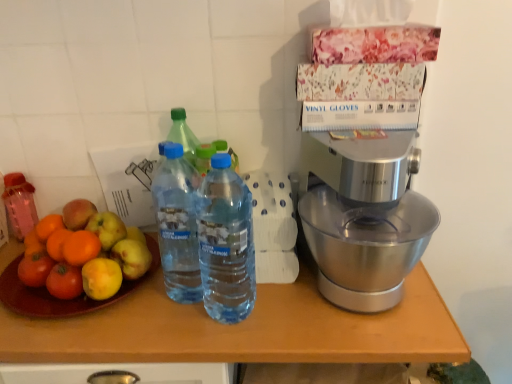
I want to click on free location to the left of blue plastic bottle at center, positioned as the second bottle in left-to-right order, so pyautogui.click(x=110, y=322).